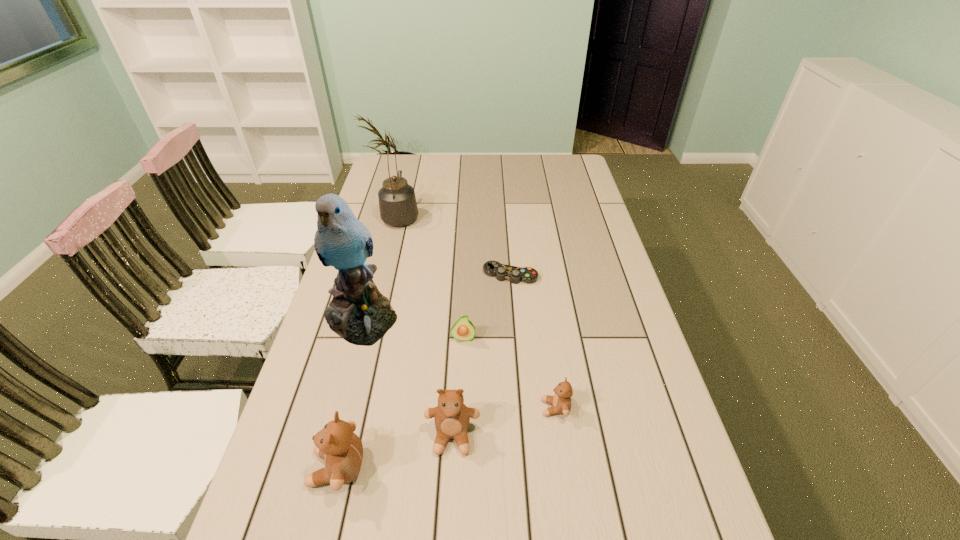
You are a GUI agent. You are given a task and a screenshot of the screen. Output one action in this format:
    pyautogui.click(x=<x>, y=<y>)
    Task: Click on the leftmost teddy bear
    This screenshot has height=540, width=960.
    Given the screenshot: What is the action you would take?
    pyautogui.click(x=337, y=444)

Where is `the second teddy bear from right to left`? The width and height of the screenshot is (960, 540). the second teddy bear from right to left is located at coordinates (452, 417).

Identify the location of the second tallest teddy bear. Image resolution: width=960 pixels, height=540 pixels. (452, 417).

Where is `the shortest teddy bear`? the shortest teddy bear is located at coordinates (561, 401).

Locate an element on the screen. The image size is (960, 540). kettle is located at coordinates (397, 202).

Identify the location of the farthest object. (397, 202).

Find the location of `the second farthest object`. the second farthest object is located at coordinates (503, 272).

Find the location of `control`. control is located at coordinates (503, 272).

This screenshot has height=540, width=960. Identify the location of avocado. pyautogui.click(x=463, y=330).

Find the location of `parakeet`. parakeet is located at coordinates (359, 313).